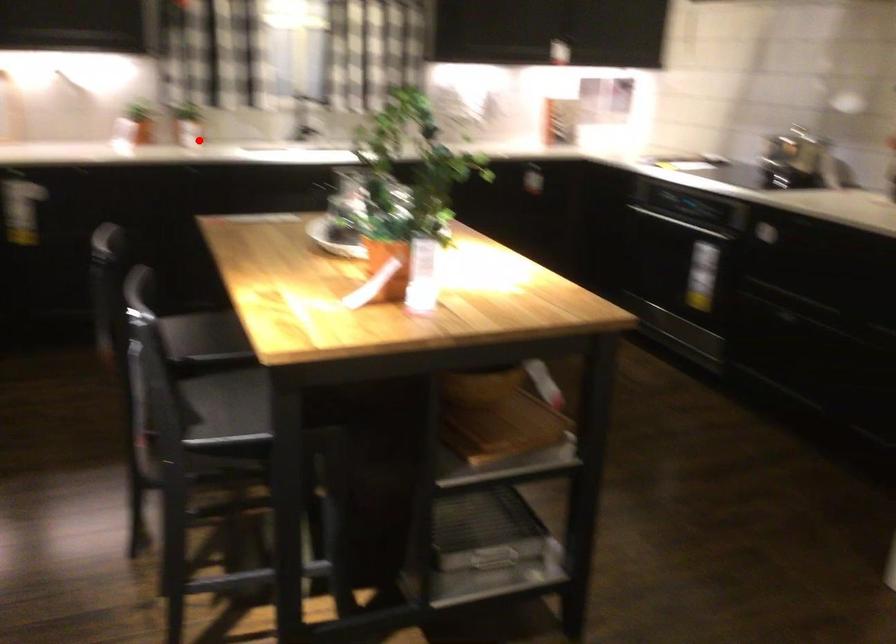
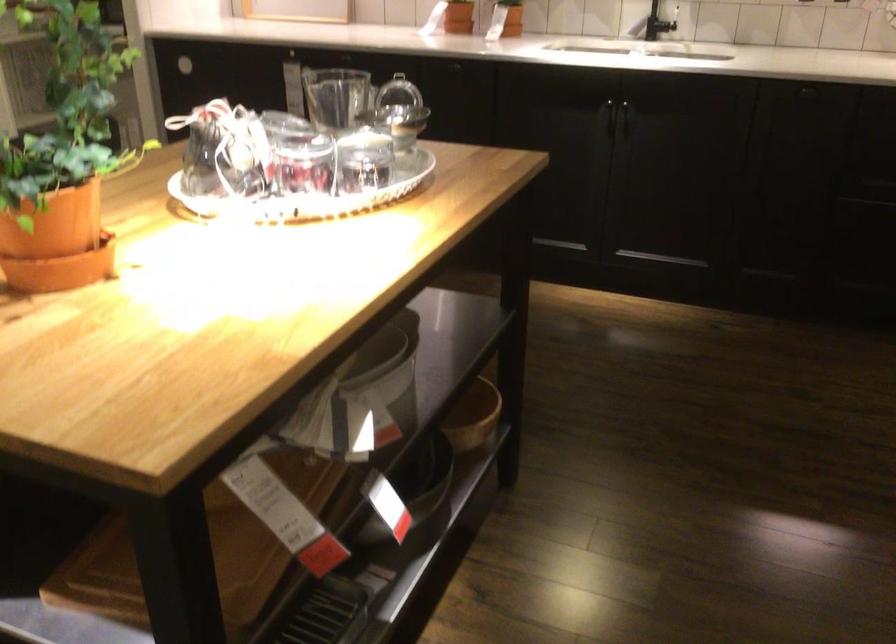
The point at the highlighted location is marked in the first image. Where is the corresponding point in the second image?

(504, 31)